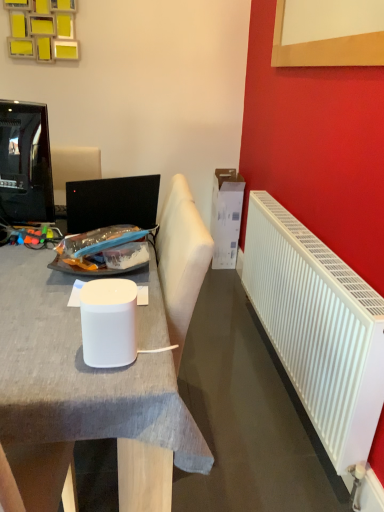
Find the location of a particular element. The image size is (384, 512). vacant area located to the right-hand side of white glossy paper cup at center is located at coordinates (153, 357).